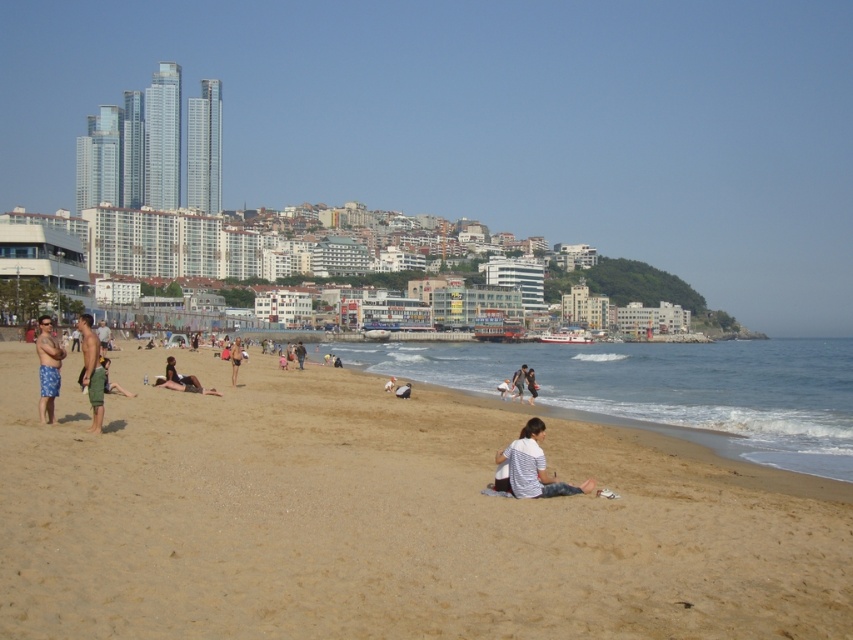
Is white striped shirt at center above matte black bikini at center?

Actually, white striped shirt at center is below matte black bikini at center.

Who is positioned more to the right, white striped shirt at center or matte black bikini at center?

white striped shirt at center

This screenshot has height=640, width=853. I want to click on white striped shirt at center, so click(534, 467).

Identify the location of white striped shirt at center. This screenshot has height=640, width=853. (534, 467).

Who is higher up, brown sandy beach at center or tan skin man at center?

tan skin man at center is above.

Who is shorter, brown sandy beach at center or tan skin man at center?

tan skin man at center is shorter.

Identify the location of brown sandy beach at center. (387, 518).

In the scene shown: Who is positioned more to the left, green fabric shorts at center or tan skin man at center?

green fabric shorts at center

Measure the distance from green fabric shorts at center to tan skin man at center.

green fabric shorts at center and tan skin man at center are 23.54 meters apart.

Who is more distant from viewer, (85, 346) or (230, 348)?

Positioned behind is point (230, 348).

Where is `green fabric shorts at center`? The width and height of the screenshot is (853, 640). green fabric shorts at center is located at coordinates pos(91,371).